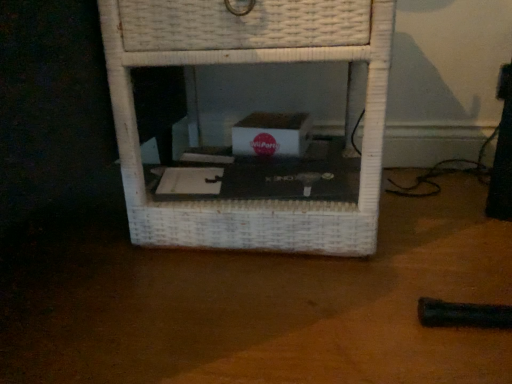
Question: In terms of size, does black matte table at center appear bigger or smaller than white wicker shelf at center?

Choices:
 (A) small
 (B) big

Answer: (A)

Question: Is black matte table at center to the left or to the right of white wicker shelf at center in the image?

Choices:
 (A) left
 (B) right

Answer: (A)

Question: Is black matte table at center taller or shorter than white wicker shelf at center?

Choices:
 (A) tall
 (B) short

Answer: (B)

Question: Considering the positions of white wicker shelf at center and black matte table at center in the image, is white wicker shelf at center taller or shorter than black matte table at center?

Choices:
 (A) short
 (B) tall

Answer: (B)

Question: Would you say white wicker shelf at center is to the left or to the right of black matte table at center in the picture?

Choices:
 (A) left
 (B) right

Answer: (B)

Question: From the image's perspective, relative to black matte table at center, is white wicker shelf at center above or below?

Choices:
 (A) above
 (B) below

Answer: (A)

Question: Does point (367, 11) appear closer or farther from the camera than point (365, 306)?

Choices:
 (A) farther
 (B) closer

Answer: (B)